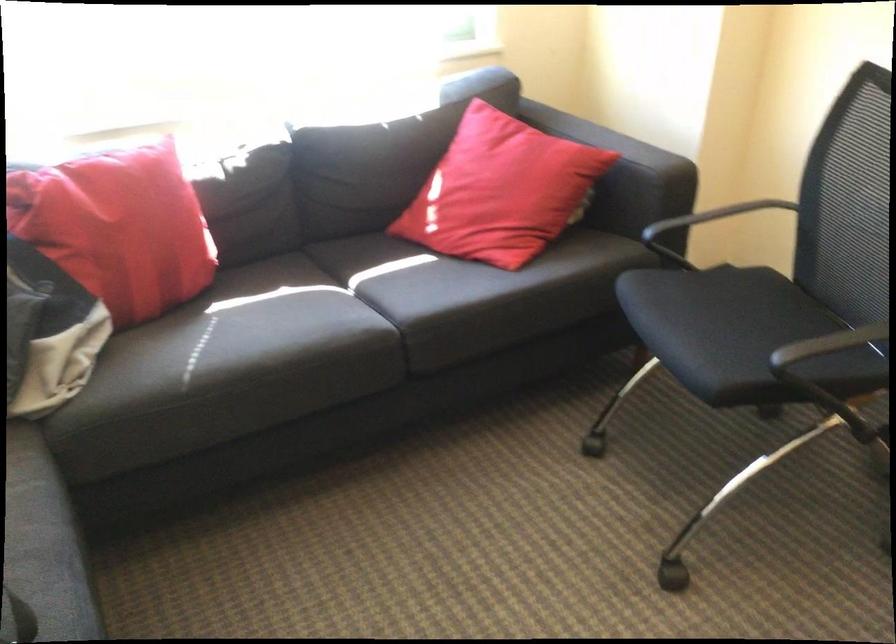
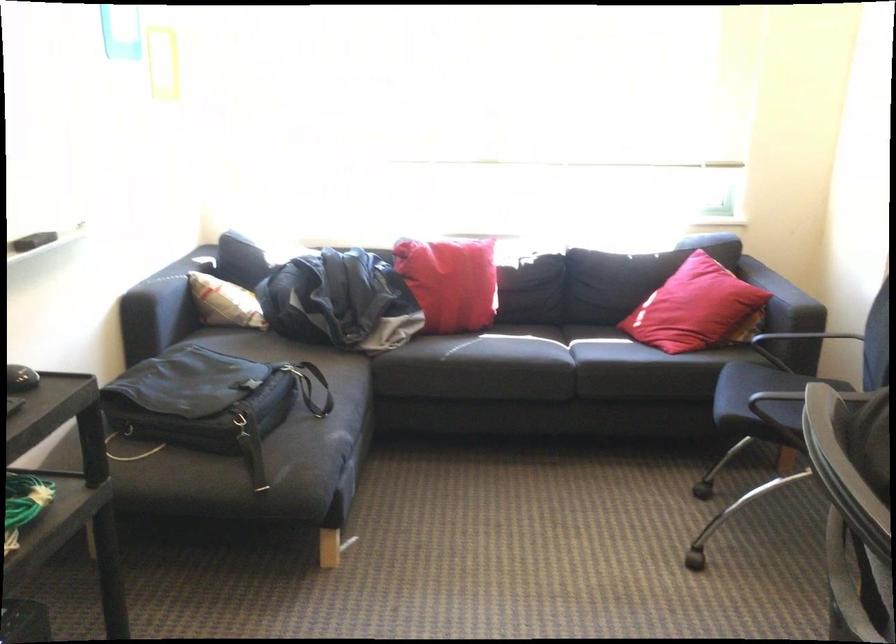
Question: I am providing you with two images of the same scene from different viewpoints. After the viewpoint changes to image2, which objects are now occluded?

Choices:
 (A) overhead projector
 (B) sofa armrest
 (C) black chair armrest
 (D) black bag strap

Answer: (B)